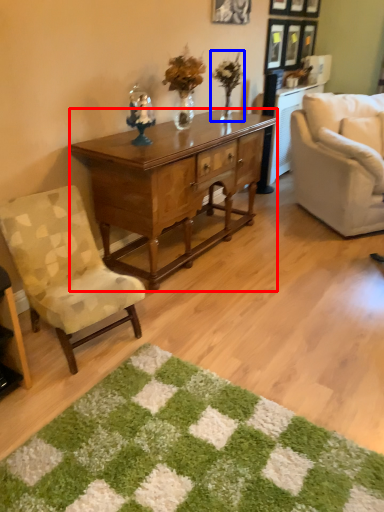
Question: Which point is closer to the camera, desk (highlighted by a red box) or houseplant (highlighted by a blue box)?

Choices:
 (A) desk
 (B) houseplant

Answer: (A)